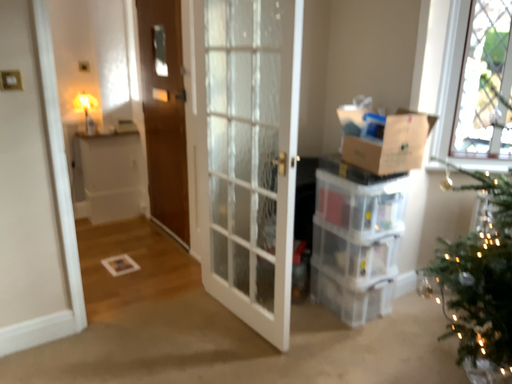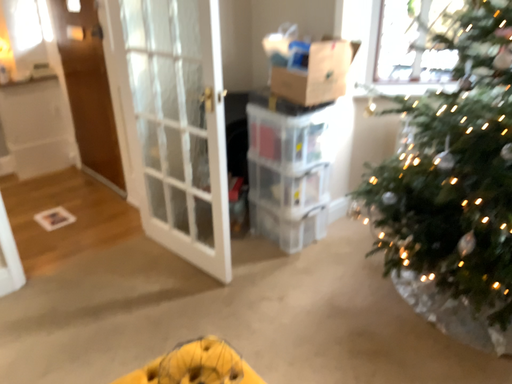
Question: How did the camera likely rotate when shooting the video?

Choices:
 (A) rotated downward
 (B) rotated upward

Answer: (A)